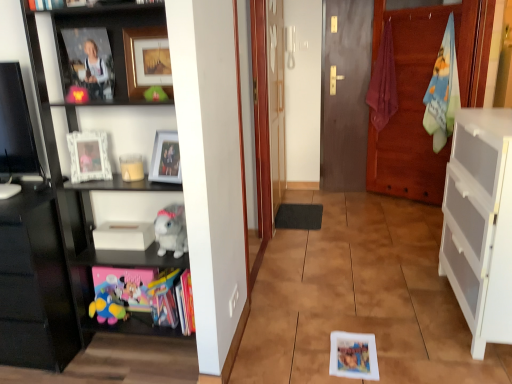
I want to click on white glossy picture frame at upper left, placed as the second picture frame when sorted from bottom to top, so click(x=89, y=156).

This screenshot has height=384, width=512. Find the location of `gray plush toy at left`. gray plush toy at left is located at coordinates (170, 230).

Identify the location of gold metallic picture frame at upper center, marked as the 1th picture frame in a top-to-bottom arrangement. The width and height of the screenshot is (512, 384). (147, 60).

What is the approximate height of black glossy cabinet at left, which is the 1th cabinetry in left-to-right order?

It is 29.01 inches.

Locate an element on the screen. The image size is (512, 384). matte glass picture frame at upper center, positioned as the 3th picture frame in top-to-bottom order is located at coordinates (165, 158).

How much space does matte plastic book at lower left, which is the second book in front-to-back order, occupy vertically?

matte plastic book at lower left, which is the second book in front-to-back order, is 10.24 inches tall.

The height and width of the screenshot is (384, 512). Find the location of `white glossy picture frame at upper left, arranged as the 2th picture frame when viewed from the top`. white glossy picture frame at upper left, arranged as the 2th picture frame when viewed from the top is located at coordinates (89, 156).

Which book is the 2nd one when counting from the back of the matte glass picture frame at upper center, the 1th picture frame in the bottom-to-top sequence? Please provide its 2D coordinates.

[(123, 236)]

How many degrees apart are the facing directions of matte glass picture frame at upper center, positioned as the 3th picture frame in top-to-bottom order, and white matte book at lower center, the second book from the bottom?

matte glass picture frame at upper center, positioned as the 3th picture frame in top-to-bottom order, and white matte book at lower center, the second book from the bottom, are facing 12.5 degrees away from each other.

From a real-world perspective, who is located lower, matte glass picture frame at upper center, positioned as the 3th picture frame in top-to-bottom order, or white matte book at lower center, positioned as the 2th book in left-to-right order?

white matte book at lower center, positioned as the 2th book in left-to-right order, from a real-world perspective.

Is matte glass picture frame at upper center, the 1th picture frame in the bottom-to-top sequence, oriented towards white matte book at lower center, the 2th book viewed from the top?

No, matte glass picture frame at upper center, the 1th picture frame in the bottom-to-top sequence, is not aimed at white matte book at lower center, the 2th book viewed from the top.

Which object is closer to the camera, white matte cabinet at right, acting as the 2th cabinetry starting from the left, or matte plastic book at lower left, placed as the third book when sorted from left to right?

white matte cabinet at right, acting as the 2th cabinetry starting from the left.

Is white matte cabinet at right, acting as the 2th cabinetry starting from the left, placed right next to matte plastic book at lower left, placed as the third book when sorted from left to right?

white matte cabinet at right, acting as the 2th cabinetry starting from the left, and matte plastic book at lower left, placed as the third book when sorted from left to right, are not in contact.

Considering the sizes of objects white matte cabinet at right, acting as the 2th cabinetry starting from the left, and matte plastic book at lower left, placed as the 3th book when sorted from top to bottom, in the image provided, who is shorter, white matte cabinet at right, acting as the 2th cabinetry starting from the left, or matte plastic book at lower left, placed as the 3th book when sorted from top to bottom,?

With less height is matte plastic book at lower left, placed as the 3th book when sorted from top to bottom.

Considering the relative positions of white matte cabinet at right, acting as the 2th cabinetry starting from the left, and matte plastic book at lower left, which is the second book in front-to-back order, in the image provided, is white matte cabinet at right, acting as the 2th cabinetry starting from the left, to the left or to the right of matte plastic book at lower left, which is the second book in front-to-back order,?

In the image, white matte cabinet at right, acting as the 2th cabinetry starting from the left, appears on the right side of matte plastic book at lower left, which is the second book in front-to-back order.

Which is behind, hardcover book at left, which is counted as the 1th book, starting from the top, or green felt toy at upper center, the first toy from the front?

green felt toy at upper center, the first toy from the front.

Locate an element on the screen. Image resolution: width=512 pixels, height=384 pixels. the 1st toy behind the hardcover book at left, the third book ordered from the bottom is located at coordinates (155, 94).

Which of these two, hardcover book at left, which is counted as the 1th book, starting from the top, or green felt toy at upper center, the 2th toy when ordered from back to front, is smaller?

green felt toy at upper center, the 2th toy when ordered from back to front.

How different are the orientations of hardcover book at left, which is counted as the 1th book, starting from the top, and green felt toy at upper center, the 2th toy when ordered from back to front, in degrees?

The angular difference between hardcover book at left, which is counted as the 1th book, starting from the top, and green felt toy at upper center, the 2th toy when ordered from back to front, is 3.88 degrees.

Is black glossy cabinet at left, which is the 1th cabinetry in left-to-right order, oriented away from matte plastic book at lower left, the first book in the right-to-left sequence?

No, black glossy cabinet at left, which is the 1th cabinetry in left-to-right order,'s orientation is not away from matte plastic book at lower left, the first book in the right-to-left sequence.

Does black glossy cabinet at left, which appears as the 2th cabinetry when viewed from the right, touch matte plastic book at lower left, which is the 1th book from bottom to top?

black glossy cabinet at left, which appears as the 2th cabinetry when viewed from the right, and matte plastic book at lower left, which is the 1th book from bottom to top, are clearly separated.

Is black glossy cabinet at left, which is the 1th cabinetry in left-to-right order, not within matte plastic book at lower left, marked as the second book in a back-to-front arrangement?

Indeed, black glossy cabinet at left, which is the 1th cabinetry in left-to-right order, is completely outside matte plastic book at lower left, marked as the second book in a back-to-front arrangement.

How distant is black glossy cabinet at left, which appears as the 2th cabinetry when viewed from the right, from matte plastic book at lower left, the first book in the right-to-left sequence?

The distance of black glossy cabinet at left, which appears as the 2th cabinetry when viewed from the right, from matte plastic book at lower left, the first book in the right-to-left sequence, is 49.72 centimeters.

From a real-world perspective, who is located lower, gold metallic picture frame at upper center, the third picture frame ordered from the bottom, or hardcover book at left, arranged as the 3th book when viewed from the back?

In real-world perspective, gold metallic picture frame at upper center, the third picture frame ordered from the bottom, is lower.

What's the angular difference between gold metallic picture frame at upper center, marked as the 1th picture frame in a top-to-bottom arrangement, and hardcover book at left, the first book in the left-to-right sequence,'s facing directions?

They differ by 0.368 degrees in their facing directions.

Between gold metallic picture frame at upper center, the third picture frame ordered from the bottom, and hardcover book at left, the third book ordered from the bottom, which one appears on the right side from the viewer's perspective?

gold metallic picture frame at upper center, the third picture frame ordered from the bottom.

This screenshot has height=384, width=512. I want to click on book above the gold metallic picture frame at upper center, the third picture frame ordered from the bottom (from a real-world perspective), so [x=45, y=4].

In terms of width, does matte plastic book at lower left, which is the 1th book from bottom to top, look wider or thinner when compared to matte glass picture frame at upper center, the 1th picture frame in the bottom-to-top sequence?

Clearly, matte plastic book at lower left, which is the 1th book from bottom to top, has more width compared to matte glass picture frame at upper center, the 1th picture frame in the bottom-to-top sequence.

Is matte plastic book at lower left, placed as the 3th book when sorted from top to bottom, not close to matte glass picture frame at upper center, the 1th picture frame in the bottom-to-top sequence?

No, matte plastic book at lower left, placed as the 3th book when sorted from top to bottom, is in close proximity to matte glass picture frame at upper center, the 1th picture frame in the bottom-to-top sequence.

Which of these two, matte plastic book at lower left, placed as the third book when sorted from left to right, or matte glass picture frame at upper center, the 1th picture frame in the bottom-to-top sequence, is smaller?

Smaller between the two is matte glass picture frame at upper center, the 1th picture frame in the bottom-to-top sequence.

Considering the relative positions of black glossy cabinet at left, which appears as the 2th cabinetry when viewed from the right, and gray plush toy at left in the image provided, is black glossy cabinet at left, which appears as the 2th cabinetry when viewed from the right, in front of gray plush toy at left?

That is True.

Which is behind, point (77, 334) or point (166, 225)?

The point (77, 334) is more distant.

Is black glossy cabinet at left, which appears as the 2th cabinetry when viewed from the right, aimed at gray plush toy at left?

No, black glossy cabinet at left, which appears as the 2th cabinetry when viewed from the right, is not turned towards gray plush toy at left.

Considering the relative positions of black glossy cabinet at left, which is the 1th cabinetry in left-to-right order, and gray plush toy at left in the image provided, is black glossy cabinet at left, which is the 1th cabinetry in left-to-right order, to the left of gray plush toy at left from the viewer's perspective?

Yes.

At what (x,y) coordinates should I click in order to perform the action: click on picture frame that is the 1st object located above the white matte book at lower center, the second book from the bottom (from the image's perspective). Please return your answer as a coordinate pair (x, y). Looking at the image, I should click on (165, 158).

Where is `book that is the 1st one when counting leftward from the white matte cabinet at right, acting as the 2th cabinetry starting from the left`? The width and height of the screenshot is (512, 384). book that is the 1st one when counting leftward from the white matte cabinet at right, acting as the 2th cabinetry starting from the left is located at coordinates (170, 301).

Which object lies further to the anchor point black glossy cabinet at left, which is the 1th cabinetry in left-to-right order, transparent glass door at center or white glossy picture frame at upper left, arranged as the 2th picture frame when viewed from the top?

Based on the image, transparent glass door at center appears to be further to black glossy cabinet at left, which is the 1th cabinetry in left-to-right order.

Estimate the real-world distances between objects in this image. Which object is further from white matte book at lower center, the 2th book viewed from the top, white matte cabinet at right, acting as the 1th cabinetry starting from the right, or black glossy shelf at left?

Based on the image, white matte cabinet at right, acting as the 1th cabinetry starting from the right, appears to be further to white matte book at lower center, the 2th book viewed from the top.

When comparing their distances from white matte book at lower center, positioned as the 2th book in left-to-right order, does white glossy picture frame at upper left, arranged as the 2th picture frame when viewed from the top, or black glossy cabinet at left, which appears as the 2th cabinetry when viewed from the right, seem closer?

white glossy picture frame at upper left, arranged as the 2th picture frame when viewed from the top, lies closer to white matte book at lower center, positioned as the 2th book in left-to-right order, than the other object.

When comparing their distances from hardcover book at left, which is counted as the 1th book, starting from the top, does white matte book at lower center, the second book from the bottom, or white matte cabinet at right, acting as the 1th cabinetry starting from the right, seem further?

white matte cabinet at right, acting as the 1th cabinetry starting from the right, lies further to hardcover book at left, which is counted as the 1th book, starting from the top, than the other object.

Which object lies nearer to the anchor point matte glass picture frame at upper center, positioned as the 3th picture frame in top-to-bottom order, white matte cabinet at right, acting as the 1th cabinetry starting from the right, or hardcover book at left, arranged as the 3th book when viewed from the back?

Based on the image, hardcover book at left, arranged as the 3th book when viewed from the back, appears to be nearer to matte glass picture frame at upper center, positioned as the 3th picture frame in top-to-bottom order.

Estimate the real-world distances between objects in this image. Which object is closer to black glossy cabinet at left, which is the 1th cabinetry in left-to-right order, gray plush toy at left or matte plastic book at lower left, the first book in the right-to-left sequence?

matte plastic book at lower left, the first book in the right-to-left sequence, is positioned closer to the anchor black glossy cabinet at left, which is the 1th cabinetry in left-to-right order.

Based on the photo, based on their spatial positions, is white glossy picture frame at upper left, arranged as the 2th picture frame when viewed from the top, or white matte book at lower center, placed as the 3th book when sorted from front to back, closer to black glossy cabinet at left, which is the 1th cabinetry in left-to-right order?

white matte book at lower center, placed as the 3th book when sorted from front to back.

Based on their spatial positions, is matte plastic book at lower left, the first book in the right-to-left sequence, or white glossy picture frame at upper left, placed as the second picture frame when sorted from bottom to top, closer to white matte book at lower center, the 2th book viewed from the top?

Based on the image, matte plastic book at lower left, the first book in the right-to-left sequence, appears to be nearer to white matte book at lower center, the 2th book viewed from the top.

Image resolution: width=512 pixels, height=384 pixels. In order to click on animal located between matte glass picture frame at upper center, positioned as the 3th picture frame in top-to-bottom order, and transparent glass door at center in the depth direction in this screenshot , I will do `click(170, 230)`.

Identify the location of animal between gold metallic picture frame at upper center, the third picture frame ordered from the bottom, and soft plush toy at lower left, which is the 1th toy in back-to-front order, vertically. coord(170,230).

This screenshot has height=384, width=512. In order to click on toy between hardcover book at left, the third book ordered from the bottom, and white matte book at lower center, the second book from the bottom, in the vertical direction in this screenshot , I will do `click(155, 94)`.

Find the location of a particular element. The width and height of the screenshot is (512, 384). animal between hardcover book at left, the third book ordered from the bottom, and transparent glass door at center, along the z-axis is located at coordinates (170, 230).